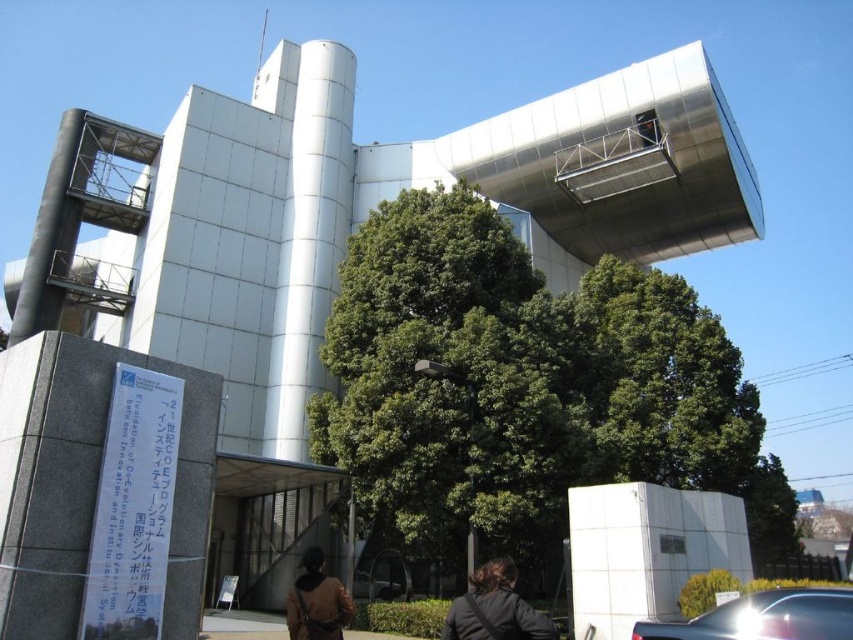
What do you see at coordinates (764, 618) in the screenshot? I see `shiny metallic car at lower right` at bounding box center [764, 618].

Is shiny metallic car at lower right wider than dark brown hair at lower center?

Yes.

Identify the location of shiny metallic car at lower right. (764, 618).

Between dark brown hair at lower center and brown leather jacket at lower center, which one appears on the left side from the viewer's perspective?

Positioned to the left is brown leather jacket at lower center.

Can you confirm if dark brown hair at lower center is taller than brown leather jacket at lower center?

In fact, dark brown hair at lower center may be shorter than brown leather jacket at lower center.

Locate an element on the screen. Image resolution: width=853 pixels, height=640 pixels. dark brown hair at lower center is located at coordinates (495, 609).

This screenshot has height=640, width=853. I want to click on dark brown hair at lower center, so click(495, 609).

Can you confirm if shiny metallic car at lower right is wider than brown leather jacket at lower center?

In fact, shiny metallic car at lower right might be narrower than brown leather jacket at lower center.

Which is more to the left, shiny metallic car at lower right or brown leather jacket at lower center?

brown leather jacket at lower center

Is point (787, 621) more distant than point (311, 600)?

No, it is not.

Identify the location of shiny metallic car at lower right. (764, 618).